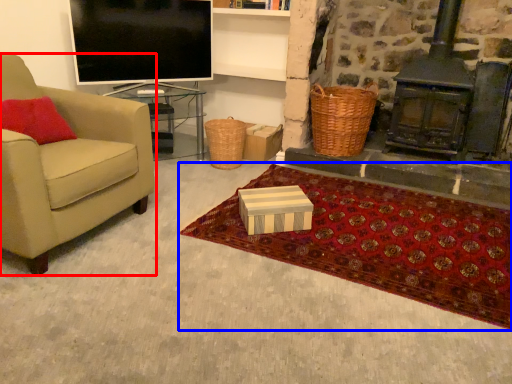
Question: Which of the following is the closest to the observer, chair (highlighted by a red box) or mat (highlighted by a blue box)?

Choices:
 (A) chair
 (B) mat

Answer: (A)